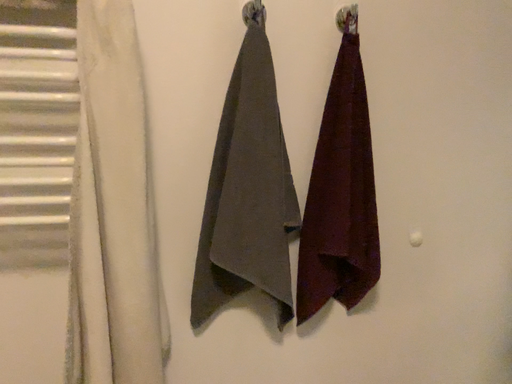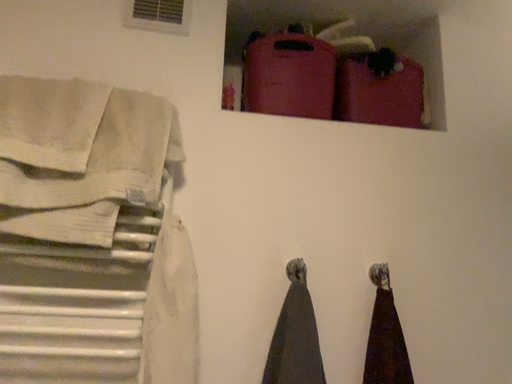
Question: Which way did the camera rotate in the video?

Choices:
 (A) rotated upward
 (B) rotated downward

Answer: (A)